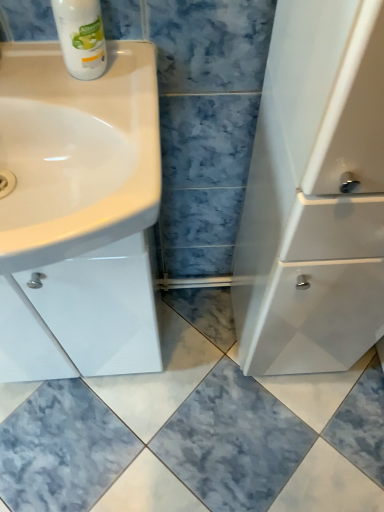
In order to click on spots to the right of white glossy bottle at upper left in this screenshot , I will do `click(127, 76)`.